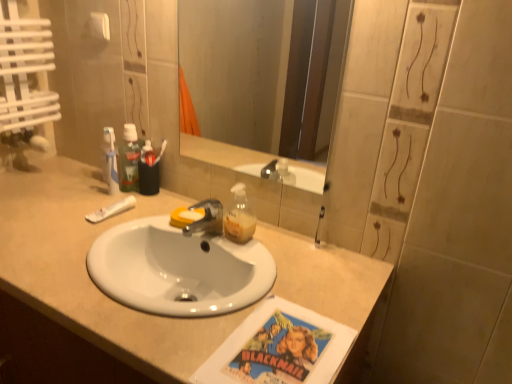
Question: Is clear glass mirror at upper center situated inside beige laminate countertop at center or outside?

Choices:
 (A) outside
 (B) inside

Answer: (A)

Question: In terms of height, does clear glass mirror at upper center look taller or shorter compared to beige laminate countertop at center?

Choices:
 (A) short
 (B) tall

Answer: (A)

Question: Based on their relative distances, which object is nearer to the white matte tube at left?

Choices:
 (A) green plastic mouthwash at upper left
 (B) beige laminate countertop at center
 (C) metallic silver tap at center
 (D) clear glass mirror at upper center

Answer: (A)

Question: Estimate the real-world distances between objects in this image. Which object is farther from the white matte tube at left?

Choices:
 (A) beige laminate countertop at center
 (B) metallic silver tap at center
 (C) clear glass mirror at upper center
 (D) green plastic mouthwash at upper left

Answer: (C)